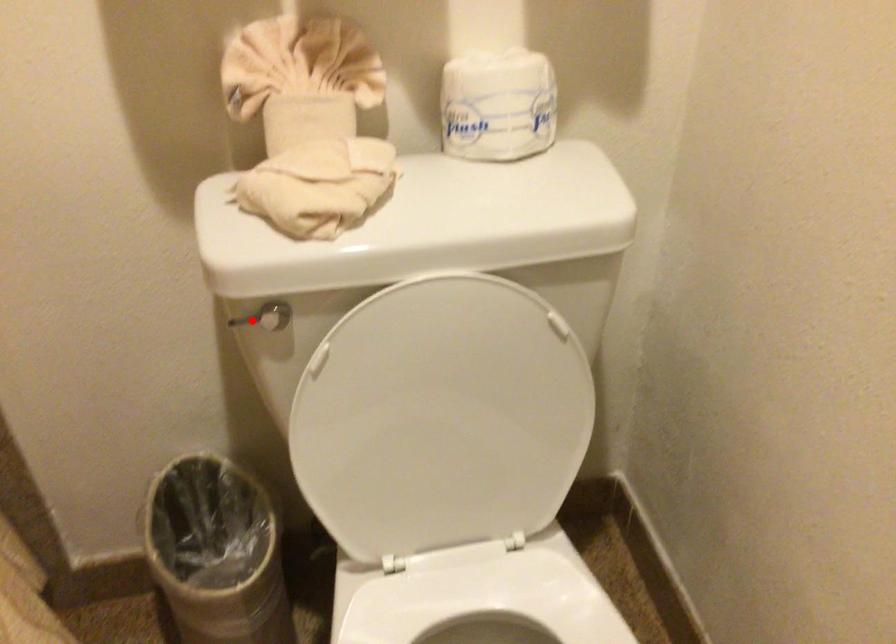
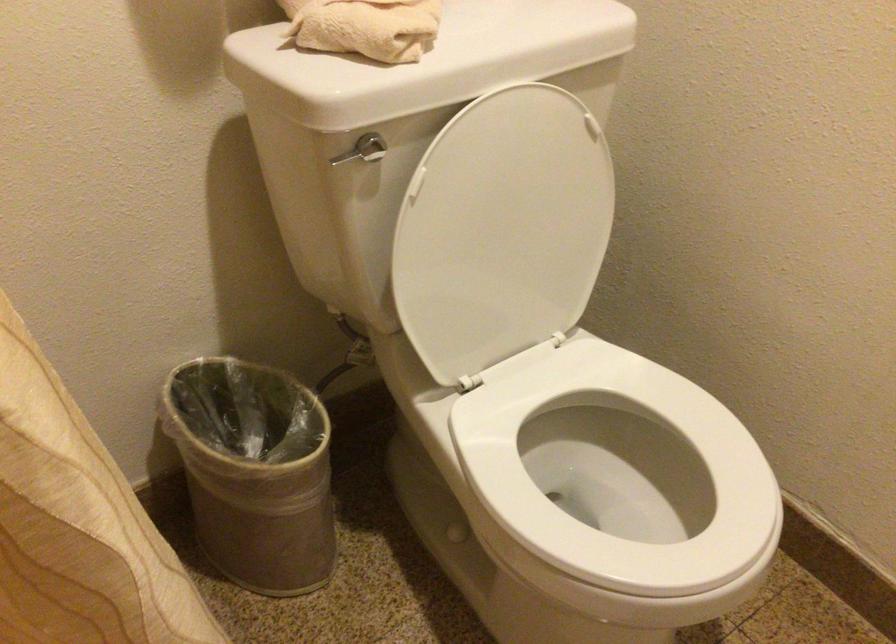
In the second image, find the point that corresponds to the highlighted location in the first image.

(348, 155)